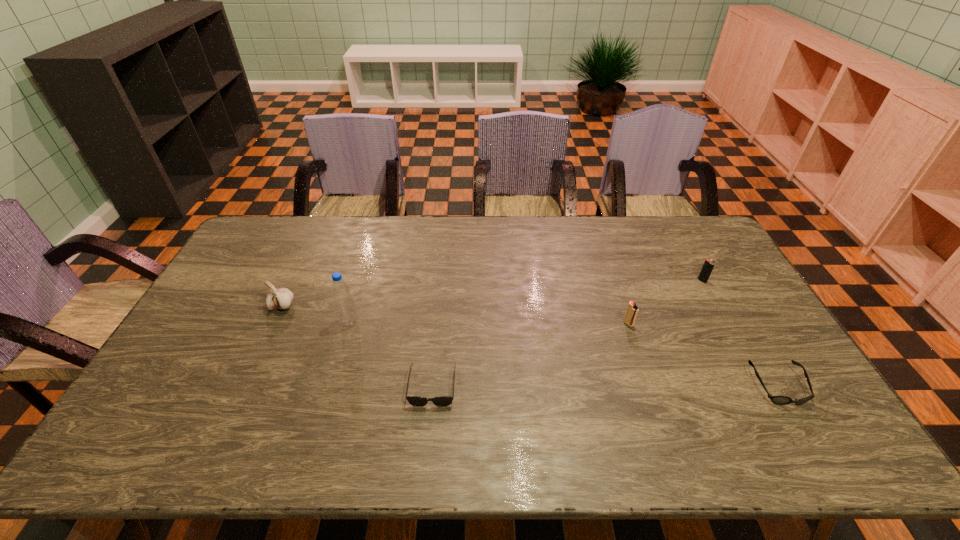
I want to click on vacant position located on the back of the water bottle, so click(x=364, y=272).

Identify the location of free space located 0.390m on the front of the garlic. The width and height of the screenshot is (960, 540). (223, 434).

Identify the location of free space located on the left of the farthest object. The width and height of the screenshot is (960, 540). (662, 281).

Locate an element on the screen. This screenshot has height=540, width=960. vacant space located on the right of the third object from right to left is located at coordinates (666, 323).

You are a GUI agent. You are given a task and a screenshot of the screen. Output one action in this format:
    pyautogui.click(x=<x>, y=<y>)
    Task: Click on the vacant space located at the front lenses of the left sunglasses
    
    Given the screenshot: What is the action you would take?
    pyautogui.click(x=427, y=445)

Locate an element on the screen. The height and width of the screenshot is (540, 960). vacant space located 0.080m on the lenses of the right sunglasses is located at coordinates (808, 437).

Locate an element on the screen. Image resolution: width=960 pixels, height=540 pixels. igniter located at the right edge is located at coordinates (708, 265).

Identify the location of sunglasses positioned at the right edge. (779, 400).

Locate an element on the screen. vacant position at the far edge of the desktop is located at coordinates (546, 231).

Where is `vacant space at the near edge of the desktop`? This screenshot has height=540, width=960. vacant space at the near edge of the desktop is located at coordinates (745, 433).